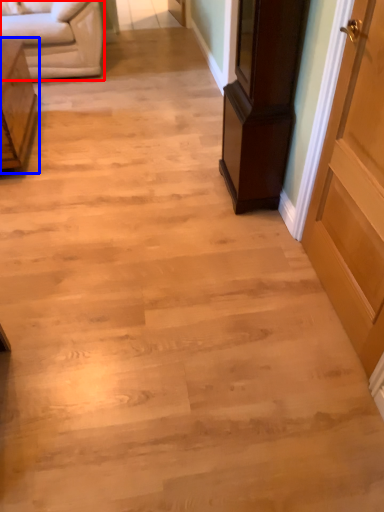
Question: Which point is closer to the camera, studio couch (highlighted by a red box) or furniture (highlighted by a blue box)?

Choices:
 (A) studio couch
 (B) furniture

Answer: (B)